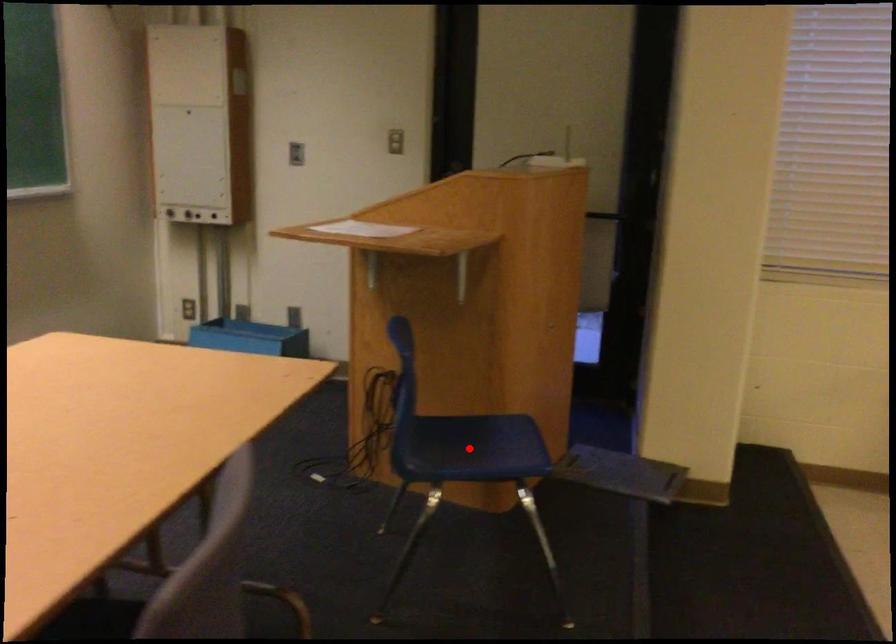
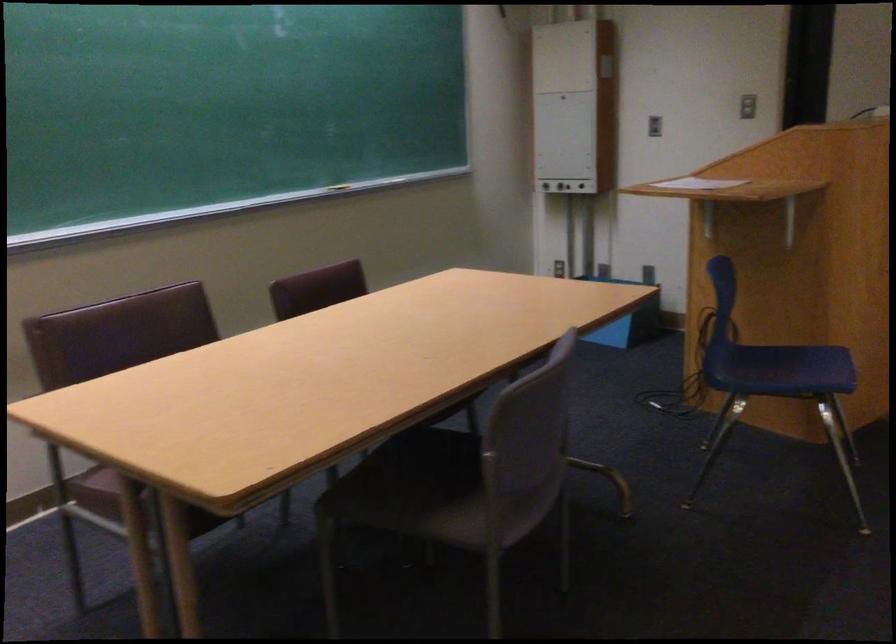
The point at the highlighted location is marked in the first image. Where is the corresponding point in the second image?

(782, 368)